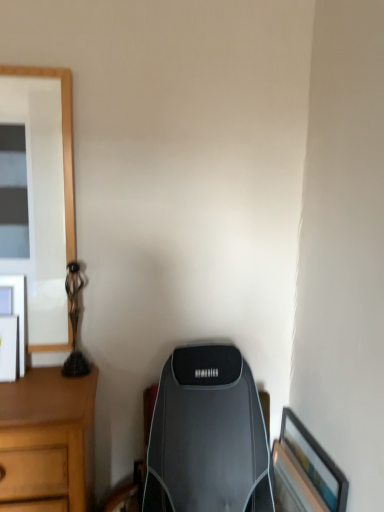
Question: From a real-world perspective, does bronze/statue at left sit lower than matte black picture frame at left, which is the 2th picture frame in bottom-to-top order?

Choices:
 (A) no
 (B) yes

Answer: (A)

Question: From the image's perspective, would you say bronze/statue at left is shown under matte black picture frame at left, which is the 2th picture frame from right to left?

Choices:
 (A) no
 (B) yes

Answer: (A)

Question: From a real-world perspective, does bronze/statue at left stand above matte black picture frame at left, which is the 2th picture frame from right to left?

Choices:
 (A) yes
 (B) no

Answer: (A)

Question: Can you confirm if bronze/statue at left is taller than matte black picture frame at left, which is the 2th picture frame from right to left?

Choices:
 (A) no
 (B) yes

Answer: (B)

Question: Is bronze/statue at left placed right next to matte black picture frame at left, the 1th picture frame viewed from the left?

Choices:
 (A) no
 (B) yes

Answer: (A)

Question: Can we say bronze/statue at left lies outside matte black picture frame at left, the 1th picture frame viewed from the top?

Choices:
 (A) no
 (B) yes

Answer: (B)

Question: Considering the relative positions of matte black picture frame at left, which is the 2th picture frame in bottom-to-top order, and bronze/statue at left in the image provided, is matte black picture frame at left, which is the 2th picture frame in bottom-to-top order, in front of bronze/statue at left?

Choices:
 (A) yes
 (B) no

Answer: (A)

Question: Is matte black picture frame at left, the 1th picture frame viewed from the left, directly adjacent to bronze/statue at left?

Choices:
 (A) no
 (B) yes

Answer: (A)

Question: Is matte black picture frame at left, which is the 2th picture frame in bottom-to-top order, not inside bronze/statue at left?

Choices:
 (A) yes
 (B) no

Answer: (A)

Question: Is matte black picture frame at left, the 1th picture frame viewed from the left, bigger than bronze/statue at left?

Choices:
 (A) yes
 (B) no

Answer: (B)

Question: Does matte black picture frame at left, which is the 2th picture frame in bottom-to-top order, have a greater height compared to bronze/statue at left?

Choices:
 (A) no
 (B) yes

Answer: (A)

Question: Is matte black picture frame at left, the 1th picture frame viewed from the left, facing towards bronze/statue at left?

Choices:
 (A) yes
 (B) no

Answer: (B)

Question: From the image's perspective, is wooden framed picture at lower right, the 1th picture frame in the bottom-to-top sequence, located above matte black picture frame at left, which is the 2th picture frame in bottom-to-top order?

Choices:
 (A) no
 (B) yes

Answer: (A)